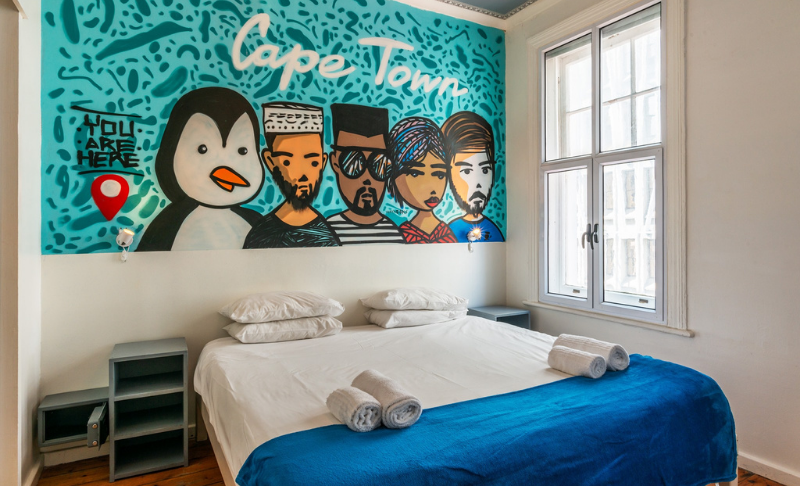
Identify the location of pillow. (412, 299).